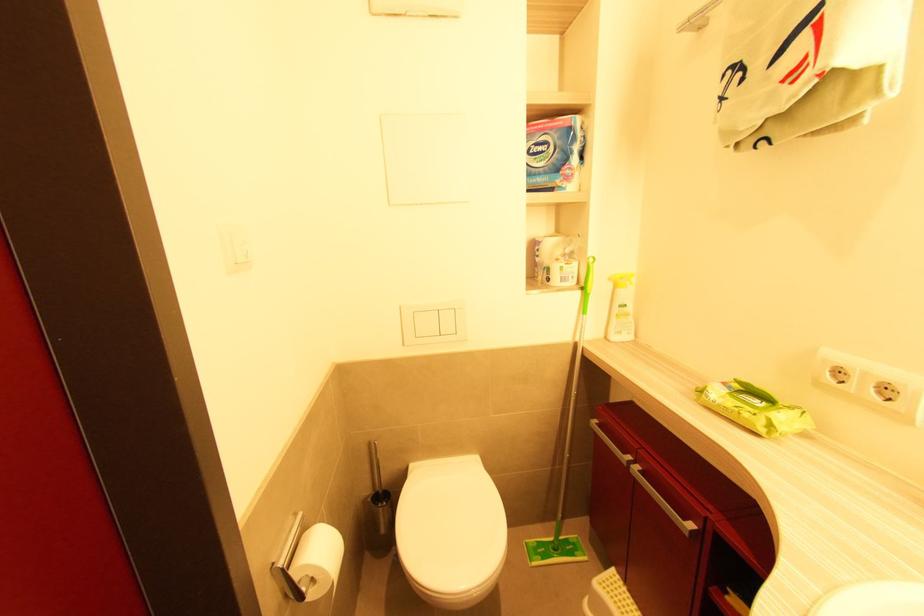
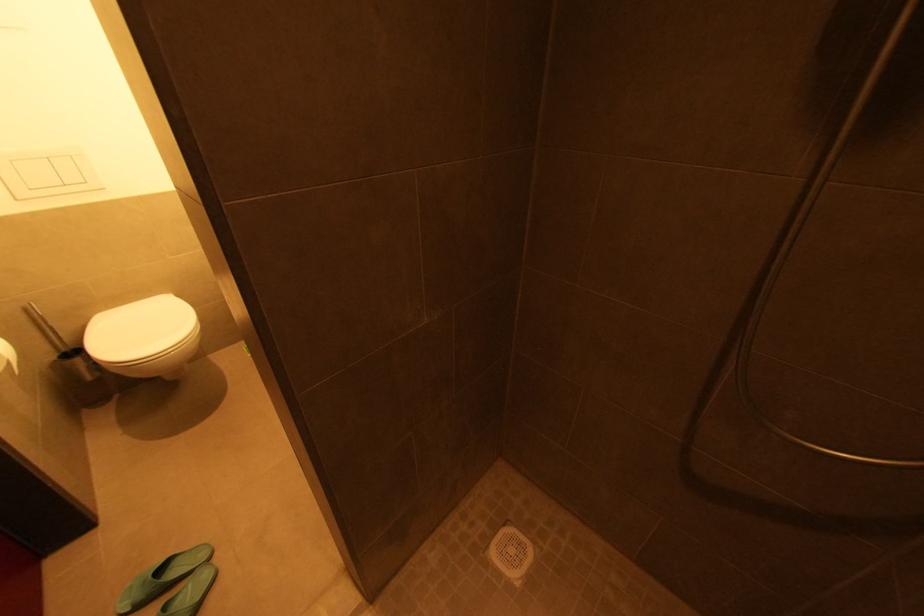
Based on the continuous images, in which direction is the camera rotating?

The camera rotated toward right-down.